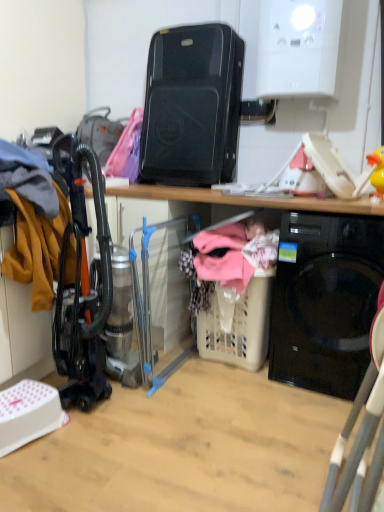
Question: Looking at the image, does beige plastic laundry basket at lower center seem bigger or smaller compared to clear plastic laundry basket at center, the 1th appliance positioned from the bottom?

Choices:
 (A) big
 (B) small

Answer: (B)

Question: Is beige plastic laundry basket at lower center inside the boundaries of clear plastic laundry basket at center, which appears as the second appliance when viewed from the top, or outside?

Choices:
 (A) inside
 (B) outside

Answer: (B)

Question: Based on their relative distances, which object is nearer to the beige plastic laundry basket at lower center?

Choices:
 (A) black plastic speaker at upper center, positioned as the second appliance in bottom-to-top order
 (B) clear plastic laundry basket at center, which appears as the second appliance when viewed from the top
 (C) black glossy washing machine at lower right

Answer: (C)

Question: Which object is positioned farthest from the beige plastic laundry basket at lower center?

Choices:
 (A) black glossy washing machine at lower right
 (B) clear plastic laundry basket at center, which appears as the second appliance when viewed from the top
 (C) black plastic speaker at upper center, the first appliance positioned from the top

Answer: (C)